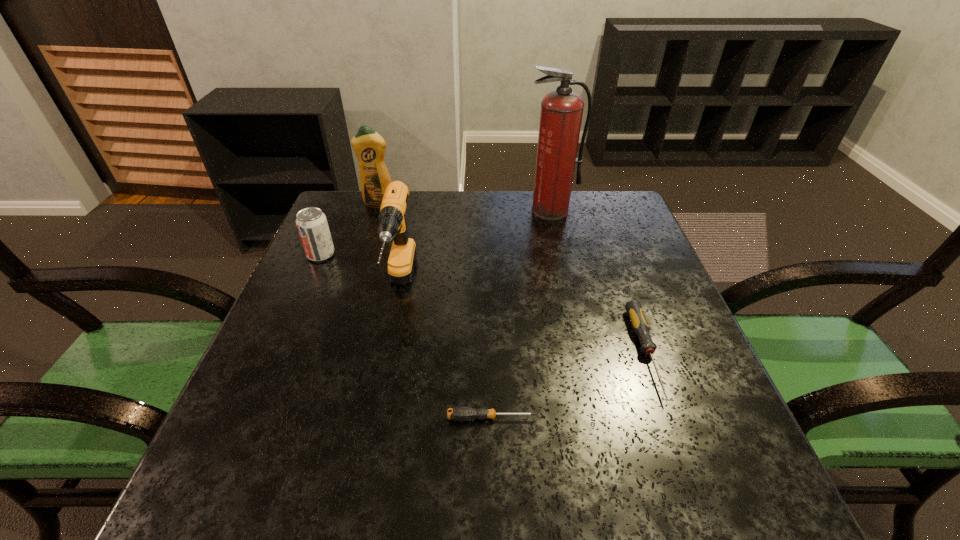
This screenshot has height=540, width=960. I want to click on object positioned at the right edge, so click(640, 326).

You are a GUI agent. You are given a task and a screenshot of the screen. Output one action in this format:
    pyautogui.click(x=<x>, y=<y>)
    Task: Click on the object situated at the far left corner
    The height and width of the screenshot is (540, 960).
    Given the screenshot: What is the action you would take?
    pyautogui.click(x=369, y=147)

Where is `vacant space at the far edge`? The width and height of the screenshot is (960, 540). vacant space at the far edge is located at coordinates (413, 234).

In the image, there is a desktop. Where is `vacant space at the near edge`? The image size is (960, 540). vacant space at the near edge is located at coordinates (495, 498).

In the image, there is a desktop. Where is `free region at the left edge`? Image resolution: width=960 pixels, height=540 pixels. free region at the left edge is located at coordinates (336, 264).

Locate an element on the screen. vacant space at the right edge of the desktop is located at coordinates (678, 309).

Locate an element on the screen. The width and height of the screenshot is (960, 540). vacant space at the far right corner of the desktop is located at coordinates coord(591,225).

The image size is (960, 540). I want to click on free space between the drill and the fourth tallest object, so click(361, 271).

Find the location of a particular element. This screenshot has width=960, height=540. vacant space in between the nearest object and the tallest object is located at coordinates (521, 314).

The height and width of the screenshot is (540, 960). Identify the location of unoccupied area between the fourth tallest object and the nearest object. (406, 336).